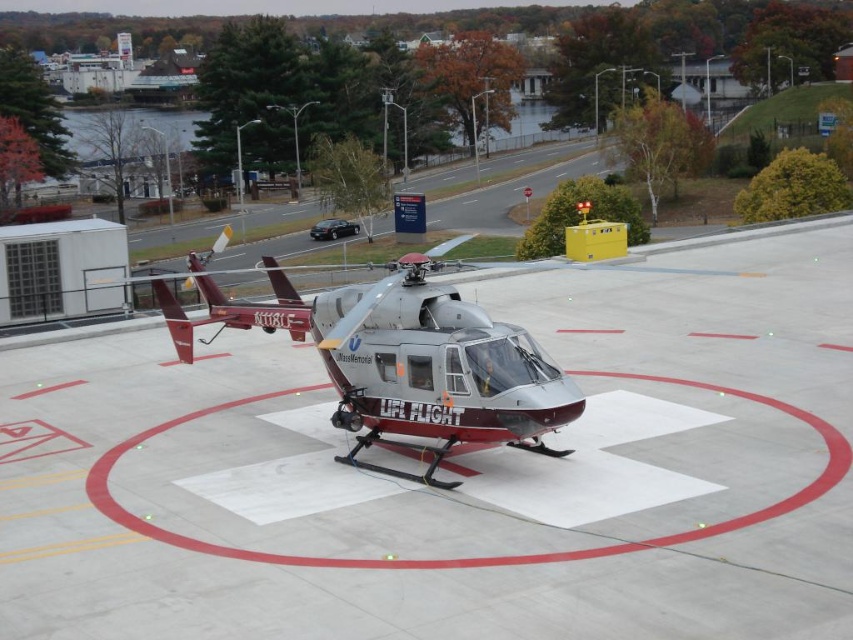
You are a drone pilot trying to navigate between two points on the helipad. The first point is at point (525, 312) and the second point is at point (358, 380). Which point is closer to the helicopter?

Point (358, 380) is closer to the helicopter because it is in front of point (525, 312), which is behind it.

You are a pilot preparing to land a helicopter. You see the smooth concrete tarmac at center and the maroon metallic helicopter at center. Which object is positioned to the right of the other?

The smooth concrete tarmac at center is to the right of the maroon metallic helicopter at center according to the description.

You are a pilot planning to land a helicopter that has a rotor span of 12 meters. The helipad has a circular landing area marked by red and white lines. Based on the image, can you determine if the smooth concrete tarmac at center is wide enough to accommodate the maroon metallic helicopter at center with its rotor span?

The smooth concrete tarmac at center might be wider than maroon metallic helicopter at center, so it is possible that the tarmac is wide enough to accommodate the helicopter with its 12 meter rotor span. However, the exact dimensions are not provided, so further verification is recommended.